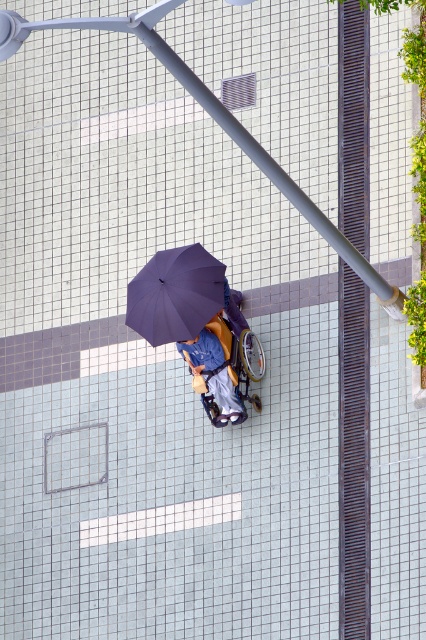
Does purple matte umbrella at center appear on the right side of blue fabric umbrella at center?

No, purple matte umbrella at center is not to the right of blue fabric umbrella at center.

Is purple matte umbrella at center taller than blue fabric umbrella at center?

No.

Does point (189, 296) come behind point (206, 346)?

No, (189, 296) is in front of (206, 346).

I want to click on purple matte umbrella at center, so click(x=175, y=294).